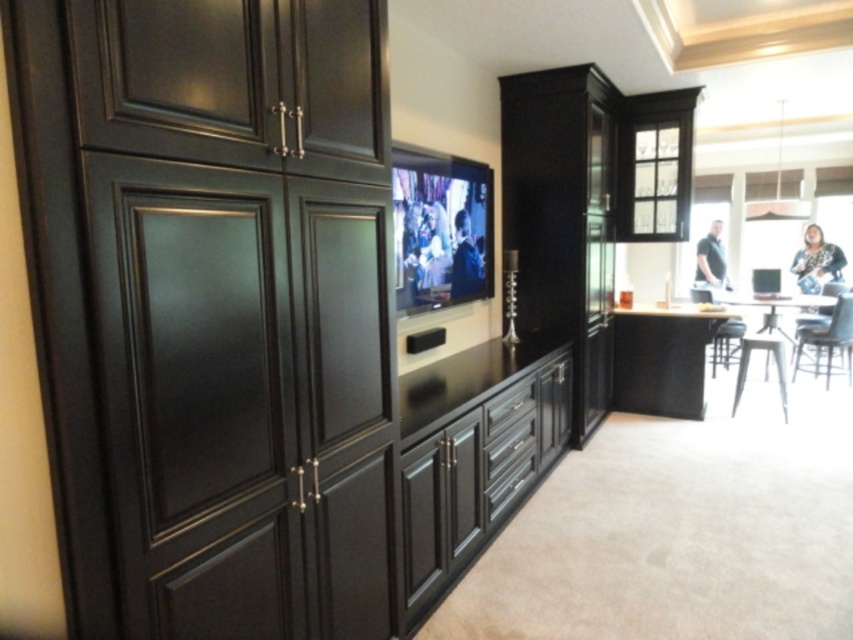
Can you confirm if matte black cabinets at center is thinner than matte black drawer at center?

No, matte black cabinets at center is not thinner than matte black drawer at center.

The image size is (853, 640). What do you see at coordinates (473, 456) in the screenshot? I see `matte black cabinets at center` at bounding box center [473, 456].

Is point (407, 481) positioned before point (524, 408)?

Yes, it is.

The image size is (853, 640). Identify the location of matte black cabinets at center. (473, 456).

Can you confirm if matte black cabinets at center is taller than flat screen tv at center?

Yes.

Is matte black cabinets at center wider than flat screen tv at center?

Yes, matte black cabinets at center is wider than flat screen tv at center.

Where is `matte black cabinets at center`? The image size is (853, 640). matte black cabinets at center is located at coordinates (473, 456).

Does flat screen tv at center appear over matte black drawer at center?

Yes, flat screen tv at center is above matte black drawer at center.

Can you confirm if flat screen tv at center is positioned to the right of matte black drawer at center?

No, flat screen tv at center is not to the right of matte black drawer at center.

Is point (465, 262) behind point (496, 413)?

Yes, it is.

At what (x,y) coordinates should I click in order to perform the action: click on flat screen tv at center. Please return your answer as a coordinate pair (x, y). The width and height of the screenshot is (853, 640). Looking at the image, I should click on (440, 228).